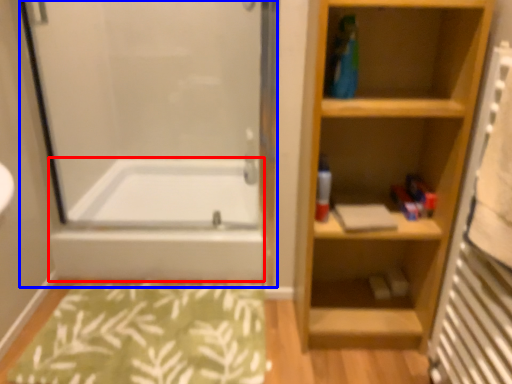
Question: Among these objects, which one is farthest to the camera, bathtub (highlighted by a red box) or screen door (highlighted by a blue box)?

Choices:
 (A) bathtub
 (B) screen door

Answer: (A)